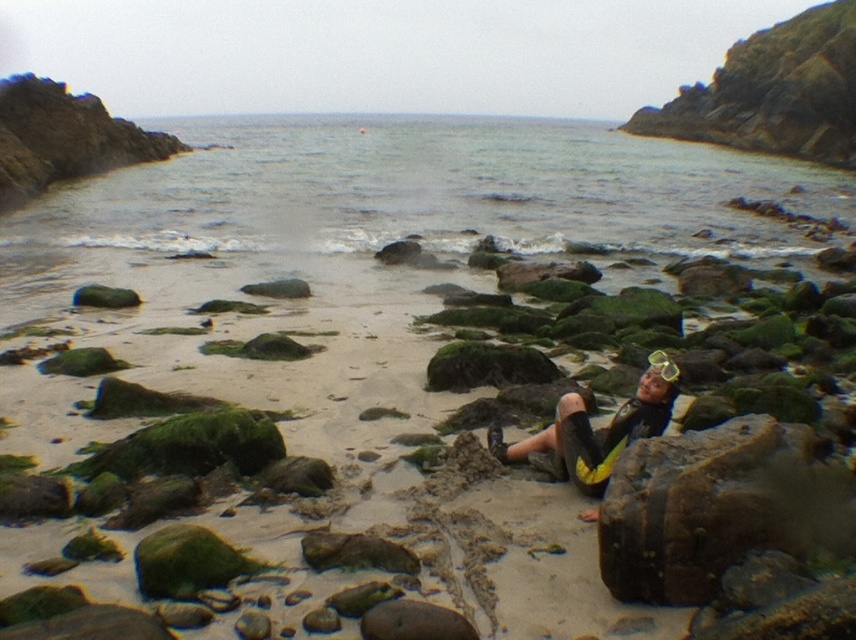
Question: Which of these objects is positioned closest to the yellow matte goggles at center?

Choices:
 (A) yellow neoprene wetsuit at center
 (B) green mossy rock at center
 (C) green mossy rock at center-left

Answer: (A)

Question: From the image, what is the correct spatial relationship of green mossy rock at center-left in relation to yellow matte goggles at center?

Choices:
 (A) right
 (B) left

Answer: (B)

Question: Is yellow neoprene wetsuit at center to the left of green mossy rock at center-left from the viewer's perspective?

Choices:
 (A) no
 (B) yes

Answer: (A)

Question: Does green mossy rock at center appear over green mossy rock at center-left?

Choices:
 (A) no
 (B) yes

Answer: (A)

Question: Which of the following is the farthest from the observer?

Choices:
 (A) (663, 356)
 (B) (620, 413)
 (C) (135, 614)

Answer: (B)

Question: Which object is the farthest from the green mossy rock at center?

Choices:
 (A) yellow neoprene wetsuit at center
 (B) yellow matte goggles at center
 (C) green mossy rock at center-left

Answer: (B)